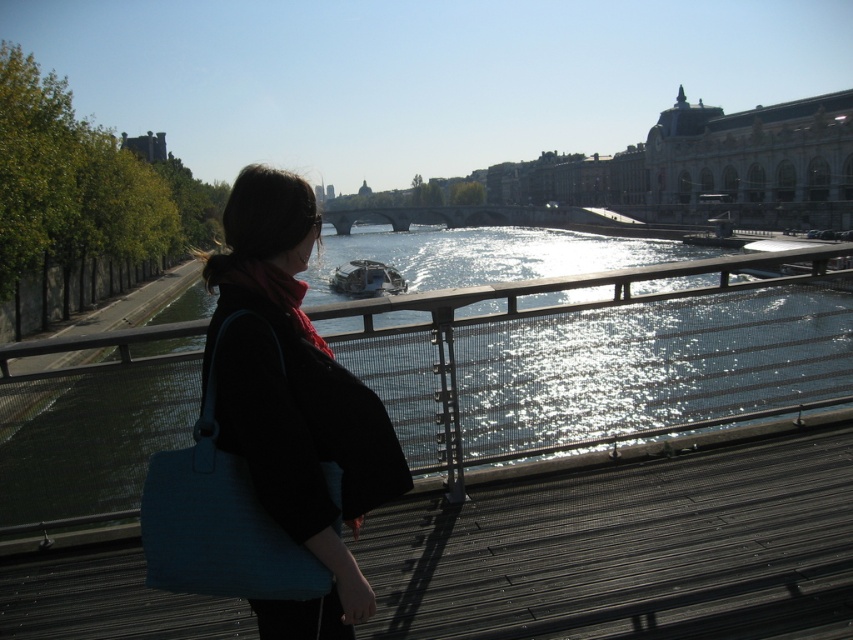
You are a photographer planning to take a photo of the serene riverside scene. You want to ensure both the matte black jacket at center and the stone bridge at center are clearly visible. Given their sizes, which object should you focus on first to ensure proper focus and composition?

The matte black jacket at center has a smaller size compared to the stone bridge at center. Therefore, you should focus on the stone bridge at center first since it is larger and will occupy more space in the photo, ensuring both elements are well captured.